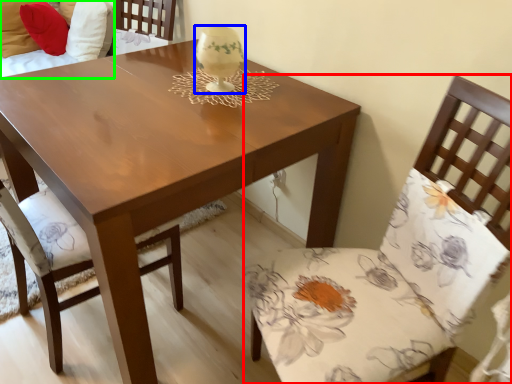
Question: Based on their relative distances, which object is nearer to chair (highlighted by a red box)? Choose from candle holder (highlighted by a blue box) and couch (highlighted by a green box).

Choices:
 (A) candle holder
 (B) couch

Answer: (A)